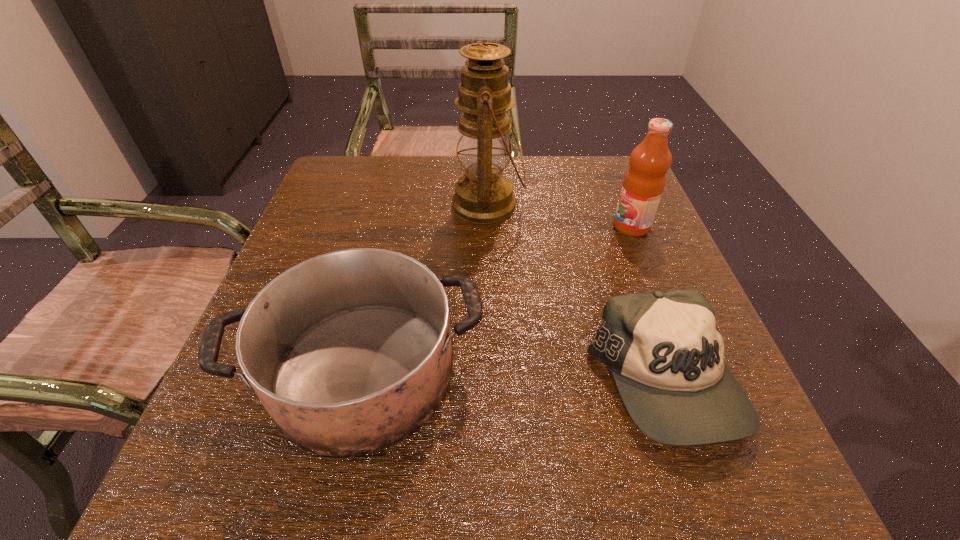
Find the location of a particular element. saucepan that is positioned at the near edge is located at coordinates (349, 352).

Identify the location of baseball cap present at the near edge. Image resolution: width=960 pixels, height=540 pixels. (665, 352).

This screenshot has width=960, height=540. What are the coordinates of `object present at the left edge` in the screenshot? It's located at (349, 352).

I want to click on fruit juice that is at the right edge, so click(644, 182).

Locate an element on the screen. baseball cap that is at the right edge is located at coordinates (665, 352).

At what (x,y) coordinates should I click in order to perform the action: click on object that is at the near left corner. Please return your answer as a coordinate pair (x, y). The image size is (960, 540). Looking at the image, I should click on (349, 352).

I want to click on object that is at the near right corner, so click(x=665, y=352).

Locate an element on the screen. Image resolution: width=960 pixels, height=540 pixels. vacant region at the far edge of the desktop is located at coordinates (530, 171).

Locate an element on the screen. Image resolution: width=960 pixels, height=540 pixels. free region at the near edge of the desktop is located at coordinates (383, 476).

What are the coordinates of `vacant space at the left edge of the desktop` in the screenshot? It's located at (335, 250).